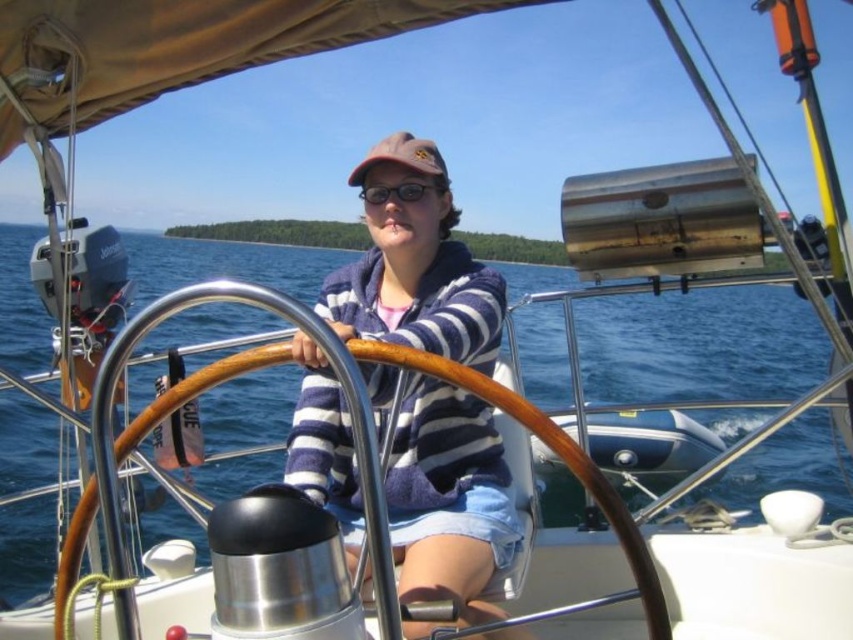
You are standing on the deck of the sailboat and want to move from point A to point B. Point A is at coordinates point (416,419) and point B is at coordinates point (651,573). Which point is closer to you when you are facing the front of the boat?

Point A at coordinates point (416,419) is closer to you because it is further to the viewer than point B at coordinates point (651,573).

You are a sailor trying to adjust your transparent plastic goggles at center while holding onto the wooden at center. Which object should you move first to make the adjustment?

You should move the wooden at center first because it is positioned on the right side of the transparent plastic goggles at center, so moving it away would allow better access to adjust the goggles.